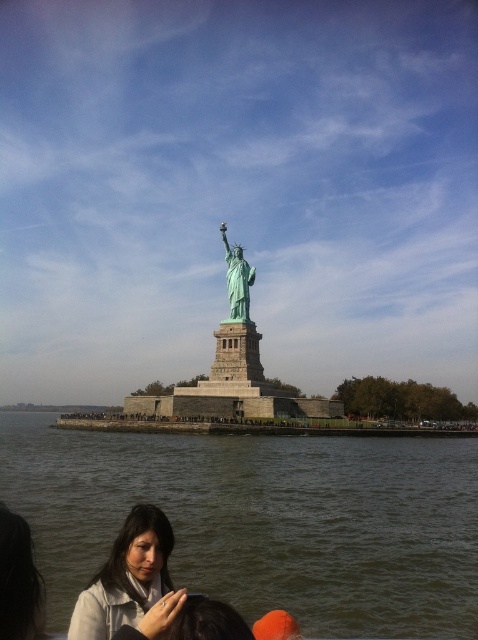
Question: Does matte gray jacket at lower left appear on the right side of green patina statue at center?

Choices:
 (A) no
 (B) yes

Answer: (A)

Question: Which point appears closest to the camera in this image?

Choices:
 (A) (113, 605)
 (B) (284, 605)
 (C) (236, 266)

Answer: (A)

Question: Among these objects, which one is farthest from the camera?

Choices:
 (A) dark brown hair at lower left
 (B) green stone water at lower center
 (C) green patina statue at center
 (D) matte gray jacket at lower left

Answer: (C)

Question: In this image, where is dark brown hair at lower left located relative to green patina statue at center?

Choices:
 (A) right
 (B) left

Answer: (B)

Question: Can you confirm if green stone water at lower center is positioned below dark brown hair at lower left?

Choices:
 (A) no
 (B) yes

Answer: (B)

Question: Which point is closer to the camera?

Choices:
 (A) matte gray jacket at lower left
 (B) green stone water at lower center

Answer: (A)